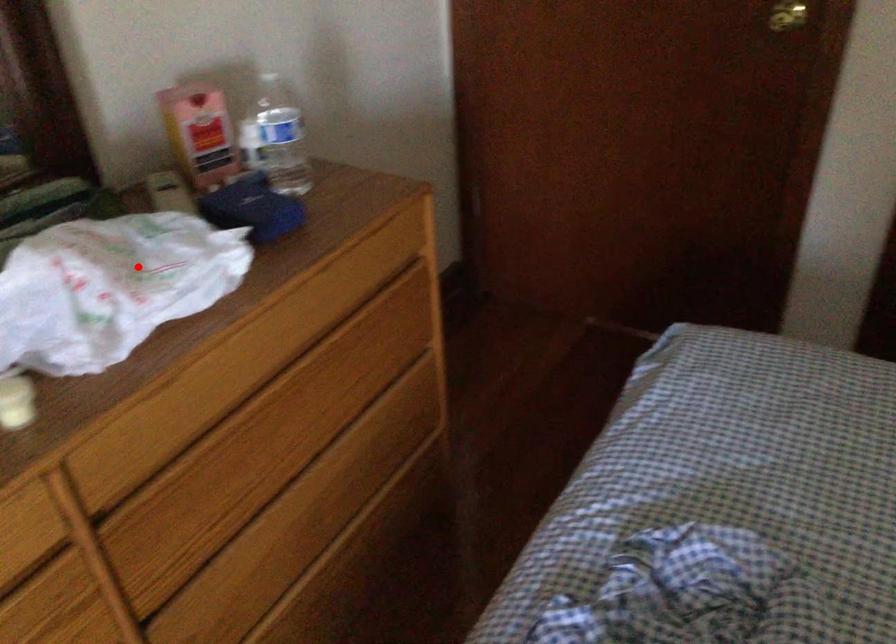
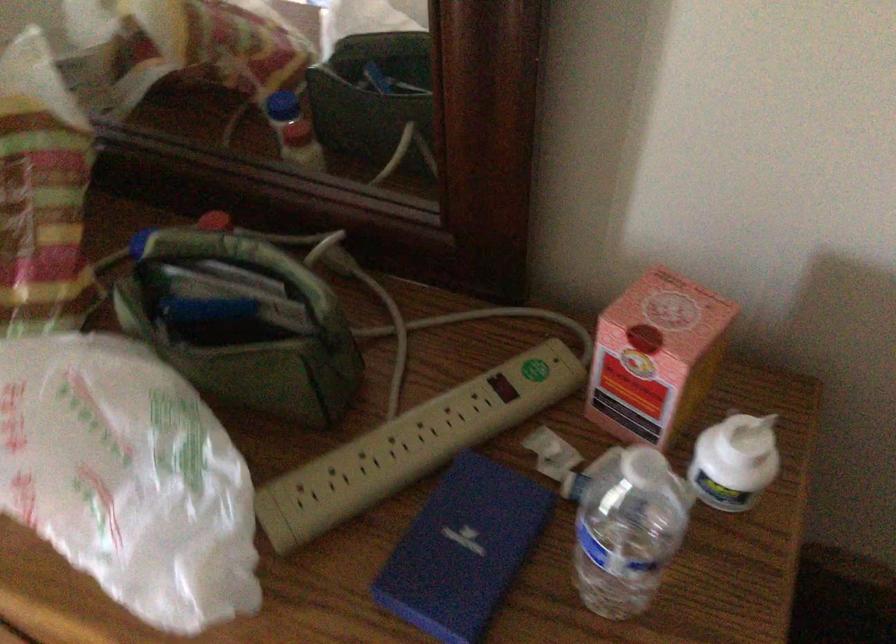
Question: I am providing you with two images of the same scene from different viewpoints. A red point is marked on the first image. At the location where the point appears in image 1, is it still visible in image 2?

Choices:
 (A) Yes
 (B) No

Answer: (A)